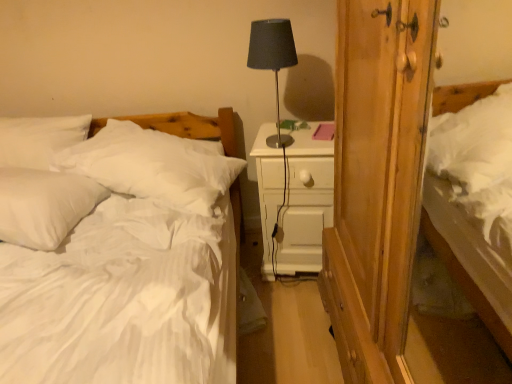
Question: Can you confirm if white soft pillow at left, the 1th pillow from the right, is wider than white soft bed at left?

Choices:
 (A) yes
 (B) no

Answer: (B)

Question: Considering the relative sizes of white soft pillow at left, which is counted as the second pillow, starting from the left, and white soft bed at left in the image provided, is white soft pillow at left, which is counted as the second pillow, starting from the left, smaller than white soft bed at left?

Choices:
 (A) no
 (B) yes

Answer: (B)

Question: From a real-world perspective, is white soft pillow at left, which is counted as the second pillow, starting from the left, positioned over white soft bed at left based on gravity?

Choices:
 (A) no
 (B) yes

Answer: (B)

Question: Does white soft pillow at left, which is counted as the second pillow, starting from the left, appear on the left side of white soft bed at left?

Choices:
 (A) yes
 (B) no

Answer: (B)

Question: From the image's perspective, is white soft pillow at left, the 1th pillow from the right, beneath white soft bed at left?

Choices:
 (A) no
 (B) yes

Answer: (A)

Question: Is point click(x=165, y=218) positioned closer to the camera than point click(x=174, y=168)?

Choices:
 (A) closer
 (B) farther

Answer: (A)

Question: Is white soft bed at left spatially inside white soft pillow at left, the 1th pillow from the right, or outside of it?

Choices:
 (A) outside
 (B) inside

Answer: (A)

Question: From a real-world perspective, is white soft bed at left above or below white soft pillow at left, which is counted as the second pillow, starting from the left?

Choices:
 (A) above
 (B) below

Answer: (B)

Question: In terms of height, does white soft bed at left look taller or shorter compared to white soft pillow at left, which is counted as the second pillow, starting from the left?

Choices:
 (A) tall
 (B) short

Answer: (A)

Question: Looking at their shapes, would you say white soft bed at left is wider or thinner than white wood nightstand at center?

Choices:
 (A) wide
 (B) thin

Answer: (A)

Question: From the image's perspective, relative to white wood nightstand at center, is white soft bed at left above or below?

Choices:
 (A) below
 (B) above

Answer: (A)

Question: From a real-world perspective, is white soft bed at left physically located above or below white wood nightstand at center?

Choices:
 (A) below
 (B) above

Answer: (B)

Question: Is white soft bed at left in front of or behind white wood nightstand at center in the image?

Choices:
 (A) behind
 (B) front

Answer: (B)

Question: Looking at the image, does matte black lamp at center seem bigger or smaller compared to white soft bed at left?

Choices:
 (A) big
 (B) small

Answer: (B)

Question: Considering the positions of matte black lamp at center and white soft bed at left in the image, is matte black lamp at center wider or thinner than white soft bed at left?

Choices:
 (A) thin
 (B) wide

Answer: (A)